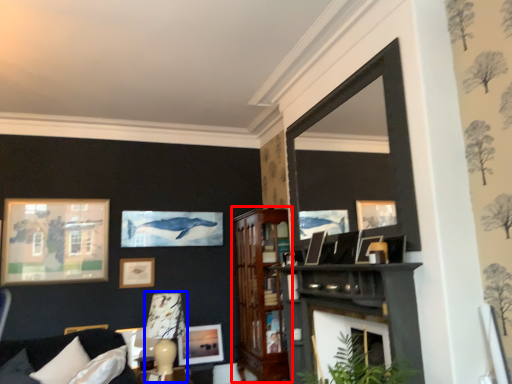
Question: Which object appears farthest to the camera in this image, dresser (highlighted by a red box) or lamp (highlighted by a blue box)?

Choices:
 (A) dresser
 (B) lamp

Answer: (A)